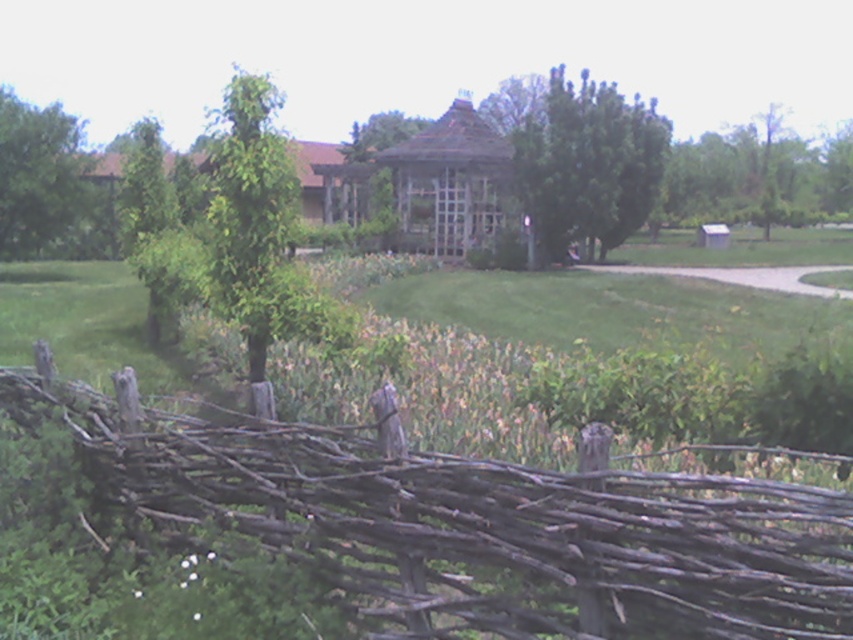
From the picture: You are standing at the entrance of the park and see the brown rustic fence at lower left and the green leafy tree at upper right. Which object is closer to you?

The brown rustic fence at lower left is closer to you because it is positioned in front of the green leafy tree at upper right.